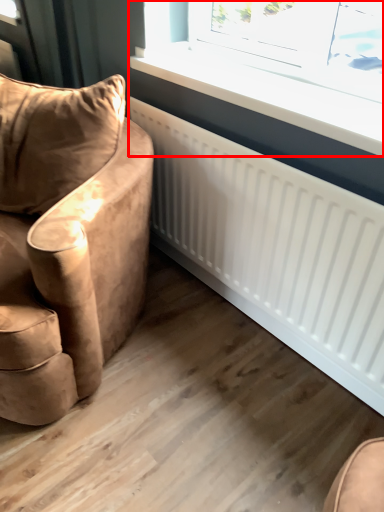
Question: Observing the image, what is the correct spatial positioning of window (annotated by the red box) in reference to chair?

Choices:
 (A) left
 (B) right

Answer: (B)